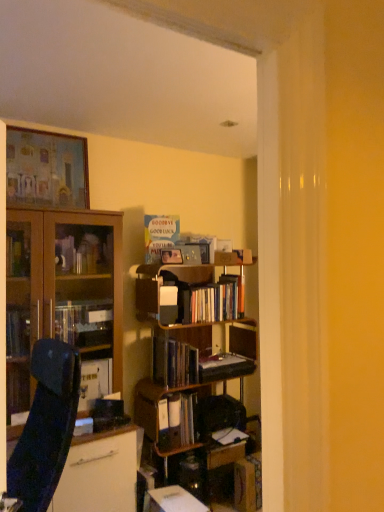
Question: Is hardcover books at center, placed as the 2th book when sorted from top to bottom, wider than wooden cabinet at left?

Choices:
 (A) yes
 (B) no

Answer: (B)

Question: From the image's perspective, does hardcover books at center, placed as the 2th book when sorted from top to bottom, appear lower than wooden cabinet at left?

Choices:
 (A) yes
 (B) no

Answer: (B)

Question: Does hardcover books at center, placed as the 2th book when sorted from top to bottom, have a smaller size compared to wooden cabinet at left?

Choices:
 (A) no
 (B) yes

Answer: (B)

Question: Is hardcover books at center, placed as the 2th book when sorted from top to bottom, looking in the opposite direction of wooden cabinet at left?

Choices:
 (A) yes
 (B) no

Answer: (B)

Question: Does hardcover books at center, placed as the 2th book when sorted from top to bottom, appear on the right side of wooden cabinet at left?

Choices:
 (A) no
 (B) yes

Answer: (B)

Question: Does hardcover books at center, which ranks as the fourth book in bottom-to-top order, have a larger size compared to wooden cabinet at left?

Choices:
 (A) yes
 (B) no

Answer: (B)

Question: Considering the relative sizes of white paper card at center, which is the 5th book in bottom-to-top order, and wooden cabinet at left in the image provided, is white paper card at center, which is the 5th book in bottom-to-top order, taller than wooden cabinet at left?

Choices:
 (A) no
 (B) yes

Answer: (A)

Question: Does white paper card at center, which is the 5th book in bottom-to-top order, turn towards wooden cabinet at left?

Choices:
 (A) no
 (B) yes

Answer: (A)

Question: Can you confirm if white paper card at center, which is the 5th book in bottom-to-top order, is smaller than wooden cabinet at left?

Choices:
 (A) no
 (B) yes

Answer: (B)

Question: From the image's perspective, would you say white paper card at center, which is the 5th book in bottom-to-top order, is positioned over wooden cabinet at left?

Choices:
 (A) yes
 (B) no

Answer: (A)

Question: Is white paper card at center, which is the 5th book in bottom-to-top order, completely or partially outside of wooden cabinet at left?

Choices:
 (A) yes
 (B) no

Answer: (A)

Question: Does white paper card at center, which is the 5th book in bottom-to-top order, lie in front of wooden cabinet at left?

Choices:
 (A) yes
 (B) no

Answer: (B)

Question: Is wooden bookcase at center smaller than hardcover books at center, placed as the 2th book when sorted from top to bottom?

Choices:
 (A) yes
 (B) no

Answer: (B)